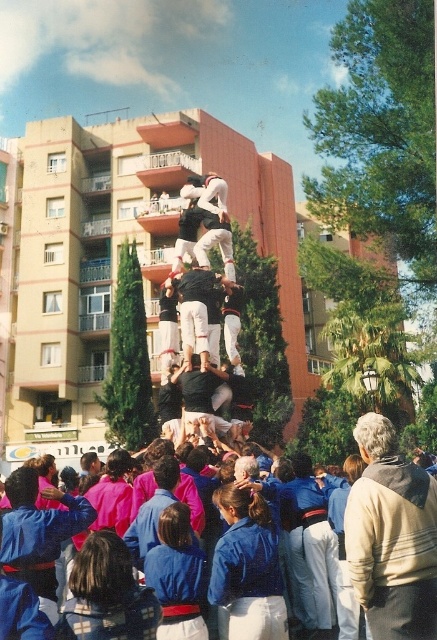
You are standing at the base of the human tower in the public square. You want to toss a beige sweater at center to a friend who is 120 feet away from you. Can you throw it far enough?

The beige sweater at center is only 105.41 feet away from the viewer, so you cannot throw it 120 feet to reach your friend.

You are standing at the point labeled as point (391, 536) in the image. Looking around, you see a beige sweater at center. What object is directly under your feet?

The point labeled as point (391, 536) is on the beige sweater at center, so the beige sweater at center is directly under your feet.